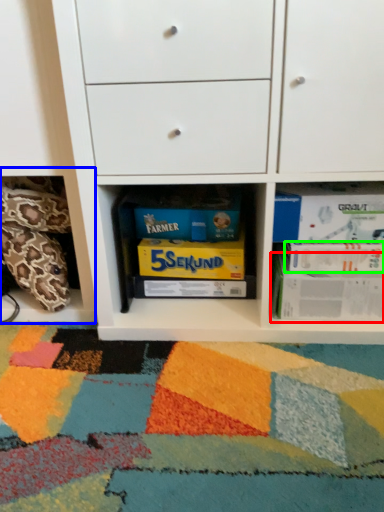
Question: Estimate the real-world distances between objects in this image. Which object is closer to paperback book (highlighted by a red box), shelf (highlighted by a blue box) or paperback book (highlighted by a green box)?

Choices:
 (A) shelf
 (B) paperback book

Answer: (B)